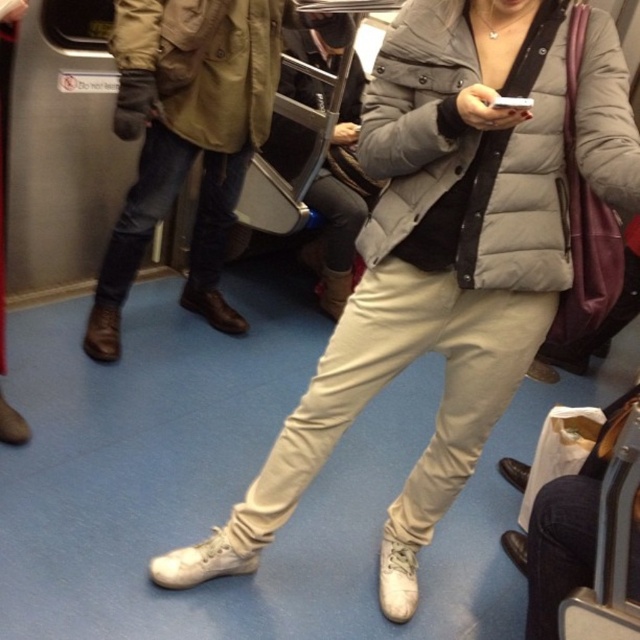
Does white leather sneakers at lower center appear over leather boots at lower left?

No, white leather sneakers at lower center is not above leather boots at lower left.

Locate an element on the screen. This screenshot has height=640, width=640. white leather sneakers at lower center is located at coordinates (429, 272).